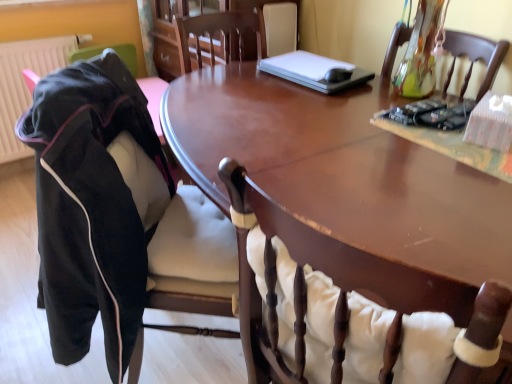
The width and height of the screenshot is (512, 384). What are the coordinates of `free spot above glossy wood table at center (from a real-world perspective)` in the screenshot? It's located at (324, 134).